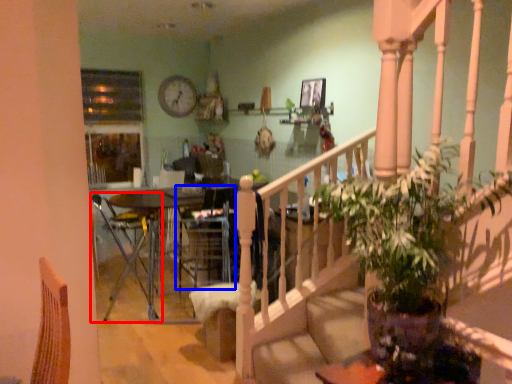
Question: Which object appears farthest to the camera in this image, chair (highlighted by a red box) or armchair (highlighted by a blue box)?

Choices:
 (A) chair
 (B) armchair

Answer: (B)